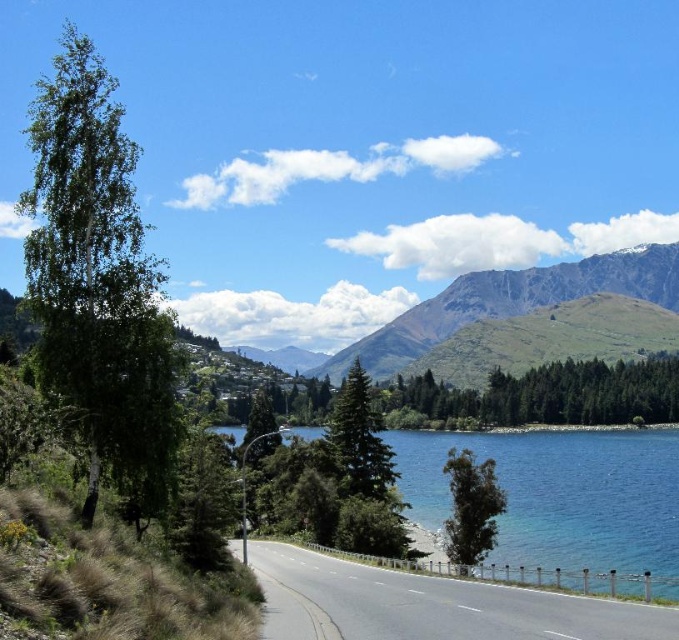
You are a hiker standing on the road and want to take a photo of the blue glassy water at center and the green textured tree at center. Which one should you focus on first to ensure both are in clear view?

The blue glassy water at center is closer to the viewer than the green textured tree at center, so focus on the blue glassy water at center first to ensure both are in clear view.